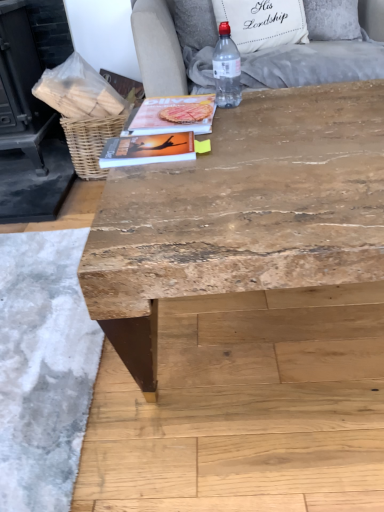
Locate an element on the screen. The image size is (384, 512). free spot below matte paper magazine at center, the second magazine from the front (from a real-world perspective) is located at coordinates (172, 118).